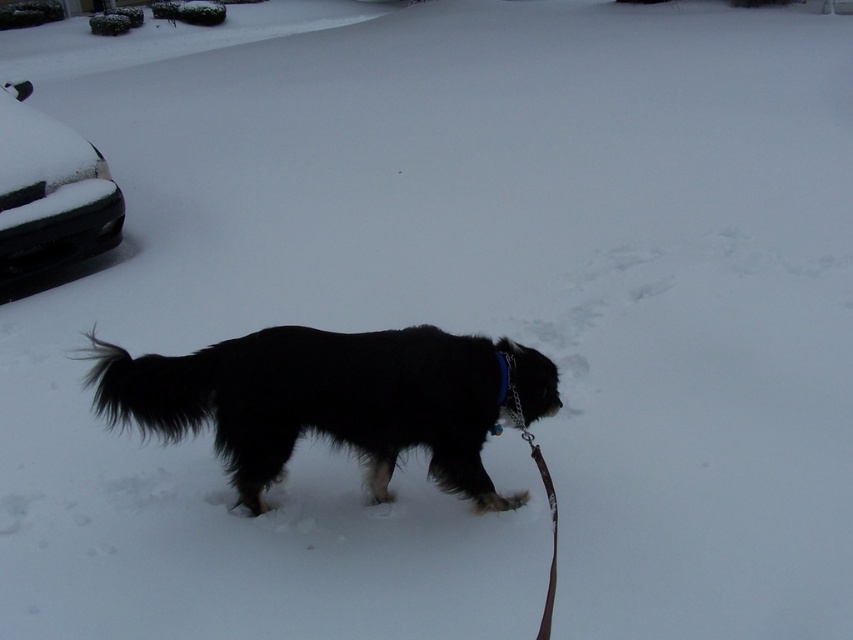
Question: Which point is farther to the camera?

Choices:
 (A) brown leather leash at lower center
 (B) black fluffy dog at center

Answer: (B)

Question: Which object appears closest to the camera in this image?

Choices:
 (A) black glossy car at left
 (B) brown leather leash at lower center

Answer: (B)

Question: Is black fluffy dog at center closer to camera compared to brown leather leash at lower center?

Choices:
 (A) yes
 (B) no

Answer: (B)

Question: Does black glossy car at left appear under brown leather leash at lower center?

Choices:
 (A) no
 (B) yes

Answer: (A)

Question: Does black fluffy dog at center lie behind brown leather leash at lower center?

Choices:
 (A) no
 (B) yes

Answer: (B)

Question: Which object is the closest to the black fluffy dog at center?

Choices:
 (A) brown leather leash at lower center
 (B) black glossy car at left

Answer: (A)